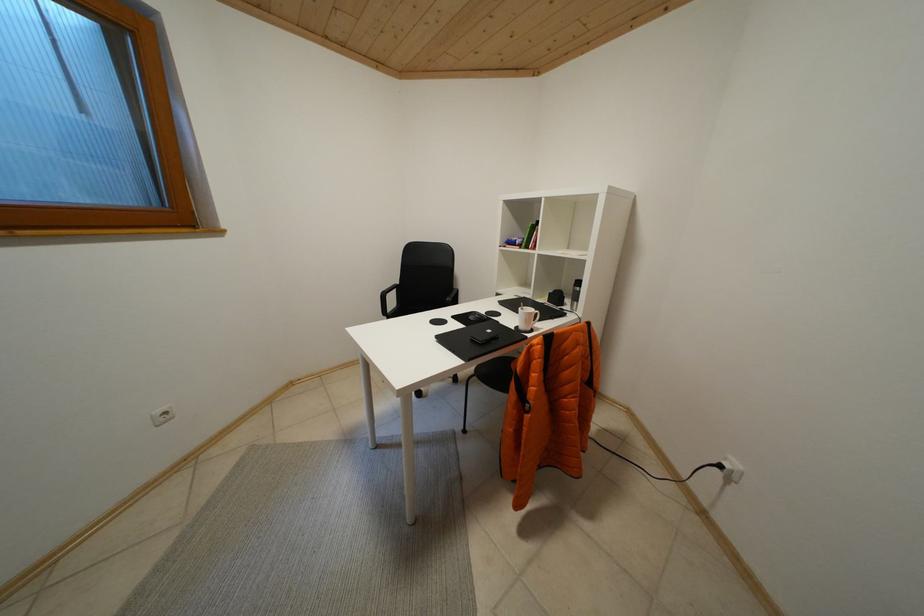
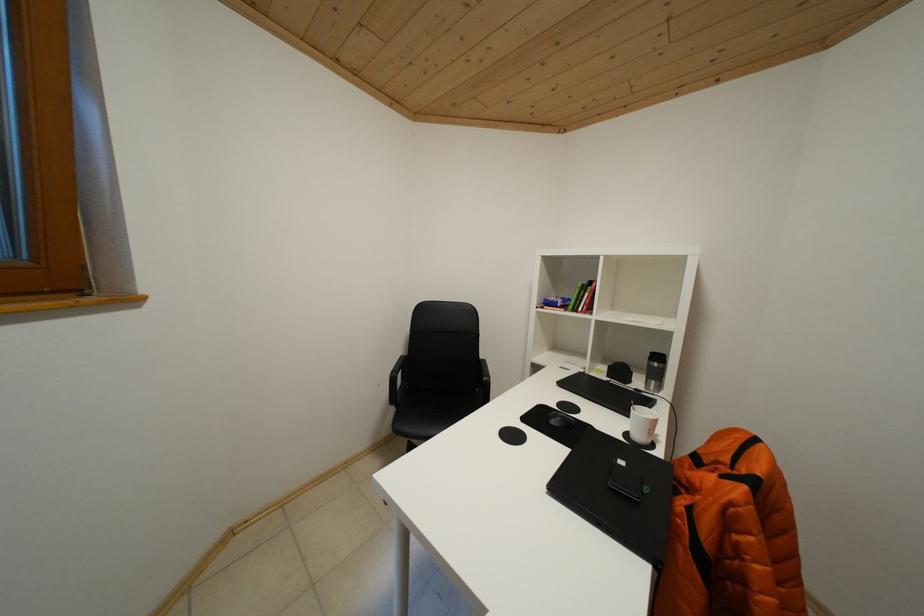
The images are taken continuously from a first-person perspective. In which direction are you moving?

The movement direction of the cameraman is left, forward.